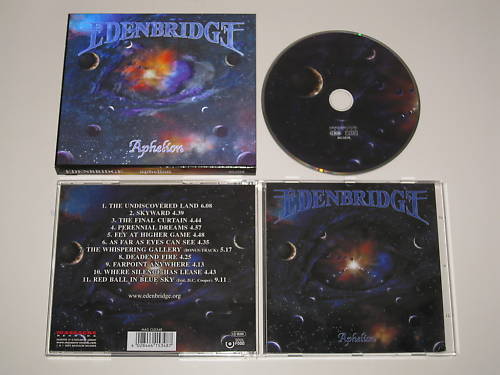
I want to click on cd booklet, so click(152, 106).